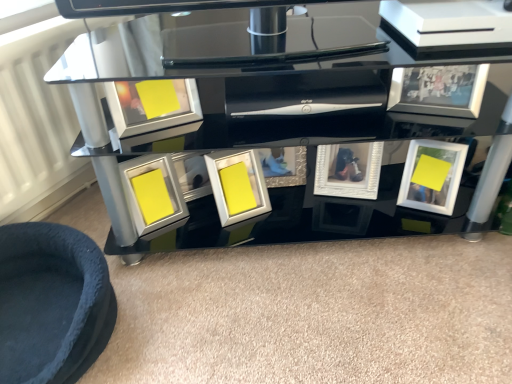
Question: In the image, is white textured frame at center, acting as the 3th picture frame starting from the right, positioned in front of or behind velvet blue pet bed at lower left?

Choices:
 (A) behind
 (B) front

Answer: (A)

Question: Looking at the image, does white textured frame at center, placed as the fourth picture frame when sorted from left to right, seem bigger or smaller compared to velvet blue pet bed at lower left?

Choices:
 (A) small
 (B) big

Answer: (A)

Question: Considering the real-world distances, which object is farthest from the black glass table at center?

Choices:
 (A) metallic silver picture frame at upper right, positioned as the fifth picture frame in left-to-right order
 (B) white glossy picture frame at lower right, the 1th picture frame from the right
 (C) matte silver picture frame at upper left, the fifth picture frame positioned from the right
 (D) velvet blue pet bed at lower left
 (E) matte yellow picture frame at center, the 1th picture frame viewed from the left

Answer: (D)

Question: Which is nearer to the matte silver picture frame at upper left, which appears as the 2th picture frame when viewed from the left?

Choices:
 (A) metallic silver picture frame at upper right, positioned as the fifth picture frame in left-to-right order
 (B) velvet blue pet bed at lower left
 (C) black glass table at center
 (D) white glossy picture frame at center, arranged as the third picture frame when viewed from the left
 (E) matte yellow picture frame at center, which appears as the 6th picture frame when viewed from the right

Answer: (E)